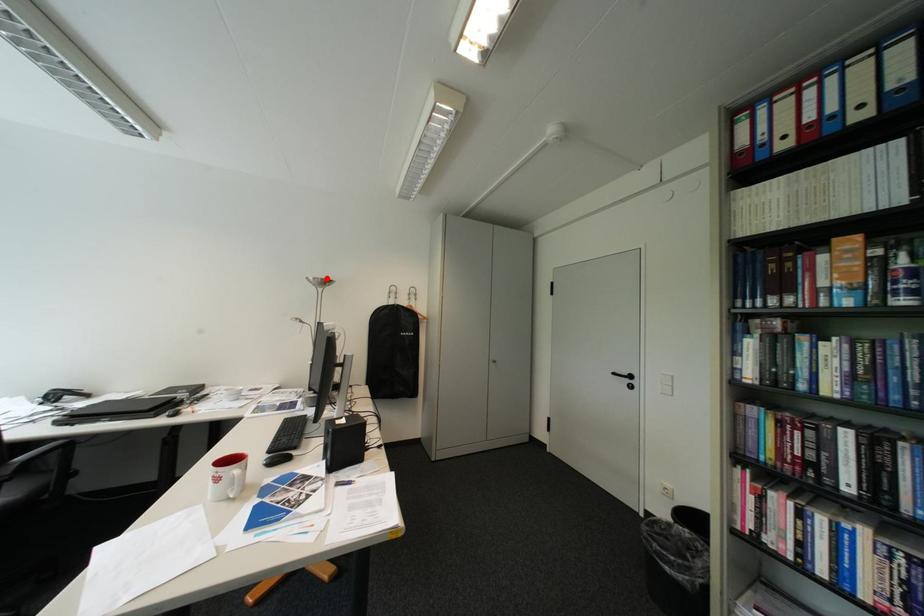
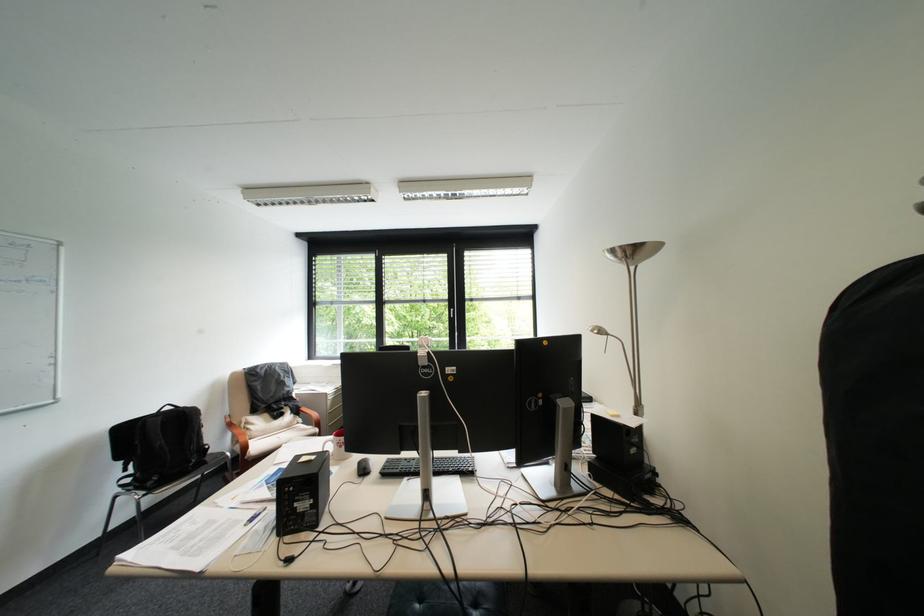
In the second image, find the point that corresponds to the highlighted location in the first image.

(625, 252)